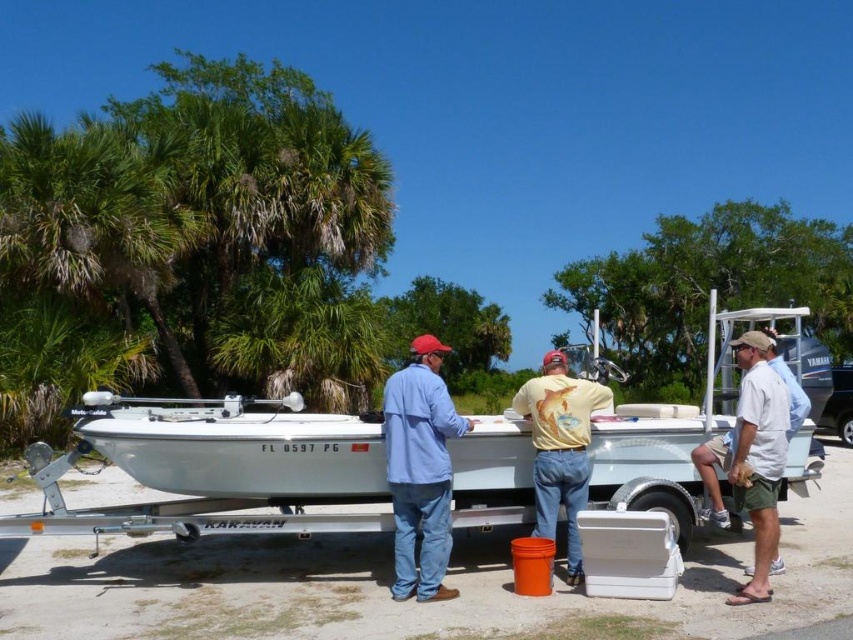
You are at the scene and want to locate the white cotton shirt at right. According to the coordinates provided, where would you look to find it?

The white cotton shirt at right is located at point 0.717 on the x axis and 0.883 on the y axis.